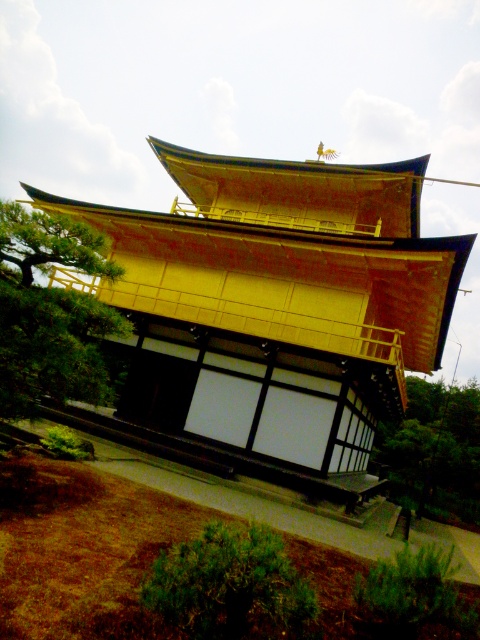
You are standing in front of the golden Japanese building and see two green leafy trees. One is labeled as the green leafy tree at left and the other as the green leafy tree at lower right. Which tree is located more to the left side?

The green leafy tree at left is positioned on the left side of the green leafy tree at lower right, so the green leafy tree at left is more to the left side.

You are standing in front of a traditional Japanese building and notice a gold lacquered wood temple at center and a green leafy bush at lower center. Which object is located to the right of the other?

The gold lacquered wood temple at center is positioned on the right side of green leafy bush at lower center.

You are a photographer planning to capture the gold lacquered wood temple at center and the green leafy bush at lower center in a single frame. Given their sizes, which object should you focus on to ensure both are clearly visible without needing to zoom in or out?

The gold lacquered wood temple at center is larger than the green leafy bush at lower center, so focusing on the temple will allow both objects to be clearly visible in the frame without adjusting the zoom.